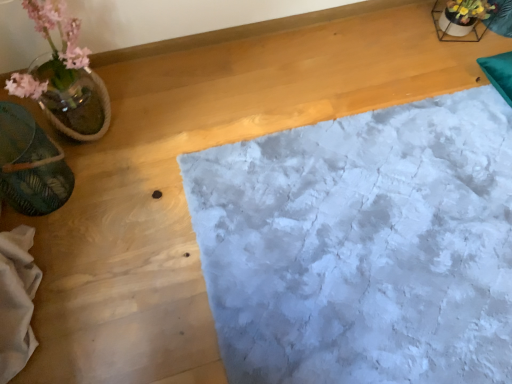
Question: Could you tell me if green leafy material at left is turned towards white textured rug at center?

Choices:
 (A) no
 (B) yes

Answer: (A)

Question: Is green leafy material at left taller than white textured rug at center?

Choices:
 (A) yes
 (B) no

Answer: (A)

Question: From the image's perspective, is green leafy material at left beneath white textured rug at center?

Choices:
 (A) yes
 (B) no

Answer: (B)

Question: Can you confirm if green leafy material at left is positioned to the right of white textured rug at center?

Choices:
 (A) yes
 (B) no

Answer: (B)

Question: Would you say green leafy material at left is a long distance from white textured rug at center?

Choices:
 (A) yes
 (B) no

Answer: (B)

Question: From the image's perspective, is green leafy material at left located above or below translucent glass vase at left?

Choices:
 (A) above
 (B) below

Answer: (B)

Question: From a real-world perspective, is green leafy material at left physically located above or below translucent glass vase at left?

Choices:
 (A) above
 (B) below

Answer: (B)

Question: Is green leafy material at left wider or thinner than translucent glass vase at left?

Choices:
 (A) wide
 (B) thin

Answer: (B)

Question: In the image, is green leafy material at left positioned in front of or behind translucent glass vase at left?

Choices:
 (A) front
 (B) behind

Answer: (B)

Question: Looking at their shapes, would you say green leafy material at left is wider or thinner than white textured rug at center?

Choices:
 (A) wide
 (B) thin

Answer: (B)

Question: Would you say green leafy material at left is to the left or to the right of white textured rug at center in the picture?

Choices:
 (A) right
 (B) left

Answer: (B)

Question: Looking at the image, does green leafy material at left seem bigger or smaller compared to white textured rug at center?

Choices:
 (A) small
 (B) big

Answer: (A)

Question: From their relative heights in the image, would you say green leafy material at left is taller or shorter than white textured rug at center?

Choices:
 (A) short
 (B) tall

Answer: (B)

Question: Based on their sizes in the image, would you say translucent glass vase at left is bigger or smaller than green leafy material at left?

Choices:
 (A) big
 (B) small

Answer: (A)

Question: In the image, is translucent glass vase at left on the left side or the right side of green leafy material at left?

Choices:
 (A) left
 (B) right

Answer: (B)